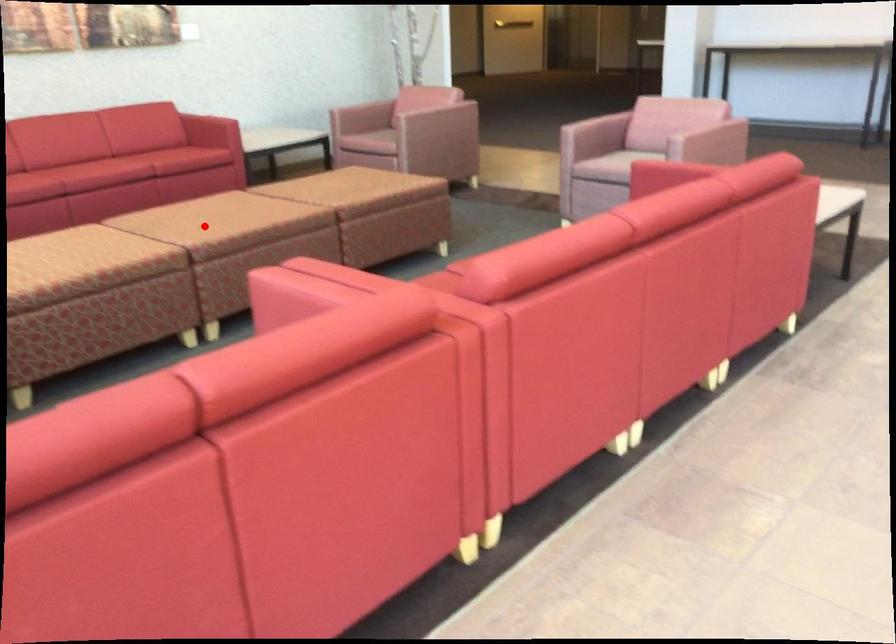
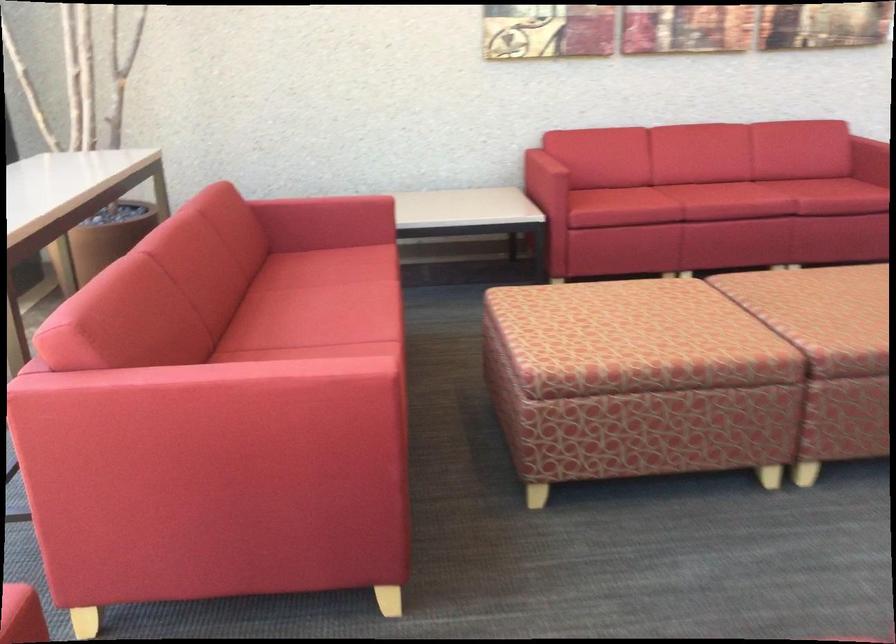
Question: A red point is marked in image1. In image2, is the corresponding 3D point closer to the camera or farther? Reply with the corresponding letter.

Choices:
 (A) The corresponding 3D point is closer.
 (B) The corresponding 3D point is farther.

Answer: (A)